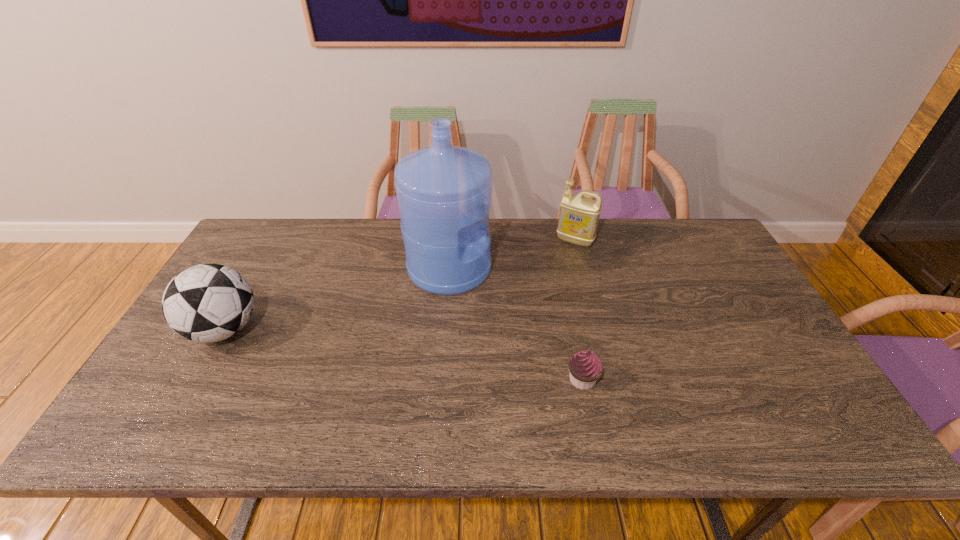
The height and width of the screenshot is (540, 960). I want to click on the tallest object, so click(444, 192).

This screenshot has width=960, height=540. I want to click on water jug, so click(x=444, y=192).

You are a GUI agent. You are given a task and a screenshot of the screen. Output one action in this format:
    pyautogui.click(x=<x>, y=<y>)
    Task: Click on the detergent
    The height and width of the screenshot is (540, 960).
    Given the screenshot: What is the action you would take?
    pyautogui.click(x=578, y=219)

Identify the location of soccer ball. This screenshot has height=540, width=960. (205, 303).

Where is `the leftmost object`? Image resolution: width=960 pixels, height=540 pixels. the leftmost object is located at coordinates (205, 303).

Image resolution: width=960 pixels, height=540 pixels. I want to click on the nearest object, so click(x=585, y=367).

You are a GUI agent. You are given a task and a screenshot of the screen. Output one action in this format:
    pyautogui.click(x=<x>, y=<y>)
    Task: Click on the shortest object
    This screenshot has height=540, width=960.
    Given the screenshot: What is the action you would take?
    pyautogui.click(x=585, y=367)

Locate an element on the screen. Image resolution: width=960 pixels, height=540 pixels. vacant space located 0.290m on the side of the water jug with the handle is located at coordinates (585, 268).

Locate an element on the screen. This screenshot has width=960, height=540. vacant space situated 0.090m on the left of the detergent is located at coordinates (529, 241).

Identify the location of vacant space located 0.230m on the surface of the leftmost object where the brand logo is visible. (348, 329).